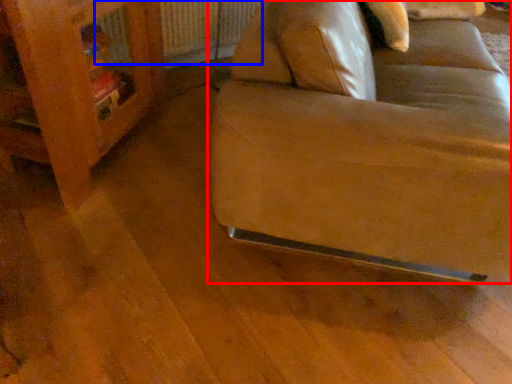
Question: Which point is closer to the camera, studio couch (highlighted by a red box) or radiator (highlighted by a blue box)?

Choices:
 (A) studio couch
 (B) radiator

Answer: (A)